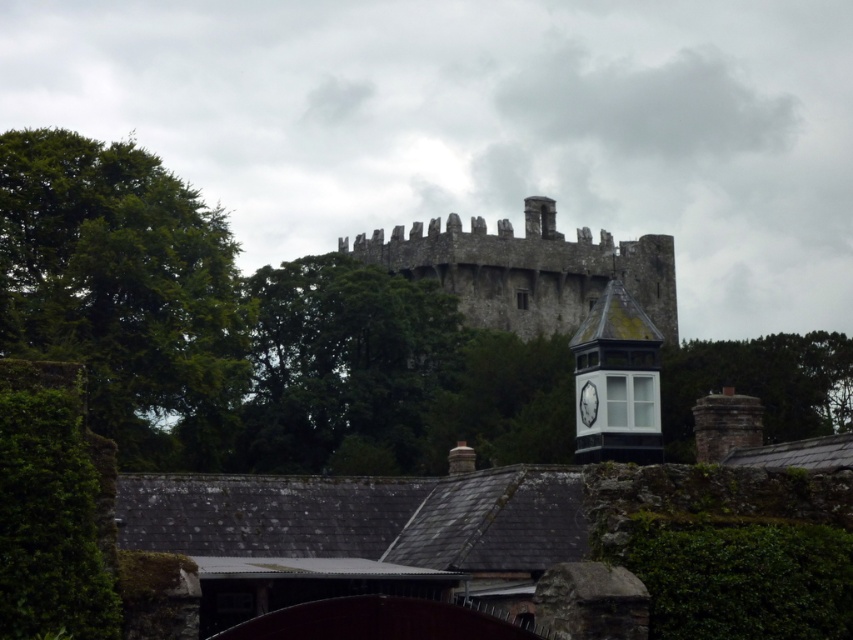
In the scene shown: You are standing in the courtyard of the historic stone structure and want to take a photo of the green leafy tree at left. Where should you position yourself to capture the tree in the frame?

The green leafy tree at left is located at coordinates point (x=125, y=292), so you should position yourself in the courtyard facing towards the left side of the scene to include the tree in your photo.

You are standing in the courtyard of the historic stone structure and want to take a photo of the dark gray stone castle at center and the green leafy tree at right. If you face the castle, which direction should you turn to include the tree in your photo?

The dark gray stone castle at center is to the left of green leafy tree at right. So, if you face the castle, you should turn to your right to include the tree in your photo.

You are standing in the courtyard of the historic stone structure and want to walk from point A to point B. Point A is located at coordinates point (753,364) and point B is at point (633,392). Which point is closer to you when you start at point A?

Point B at point (633,392) is closer to you because it is further away from the viewer compared to point A at point (753,364), which is closer to the viewer.